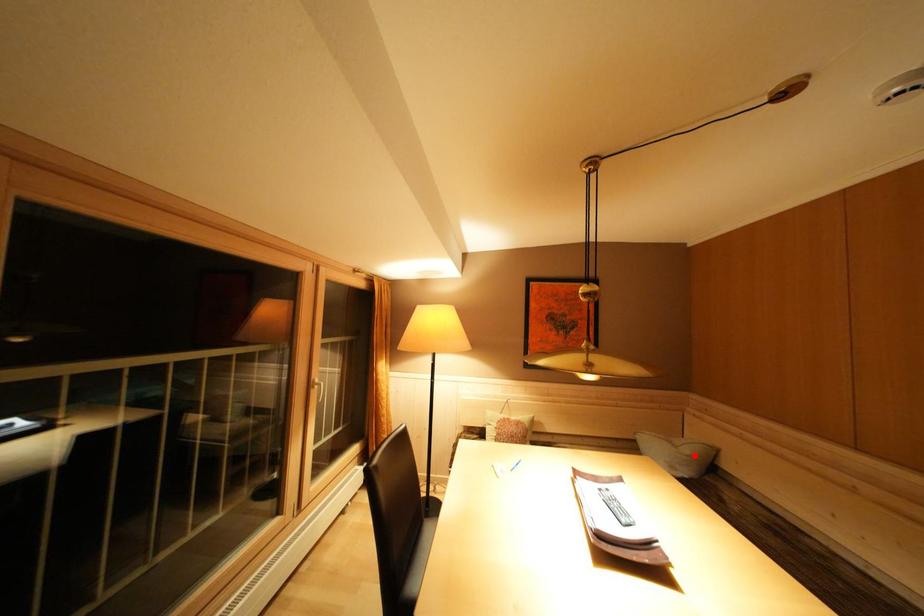
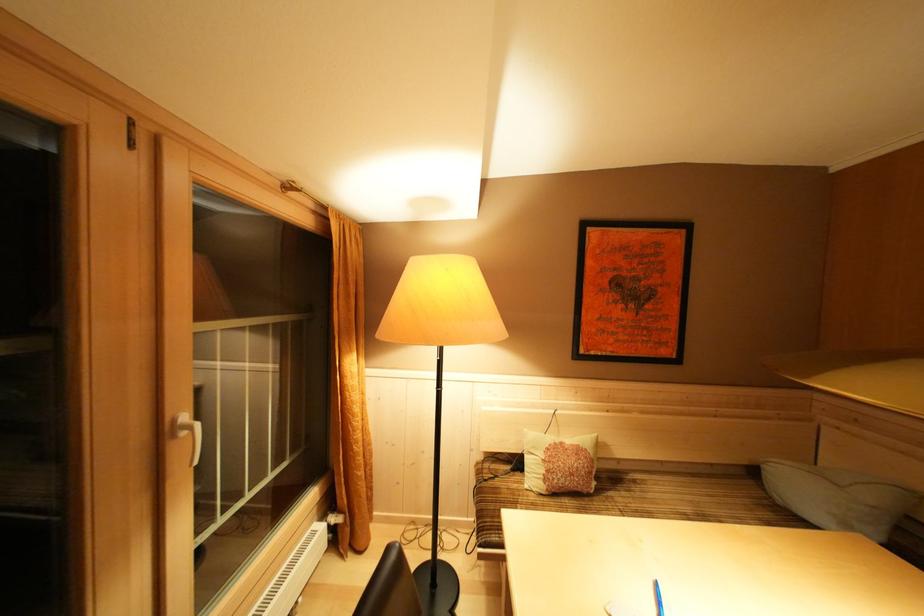
Question: I am providing you with two images of the same scene from different viewpoints. A red point is marked on the first image. At the location where the point appears in image 1, is it still visible in image 2?

Choices:
 (A) Yes
 (B) No

Answer: (A)